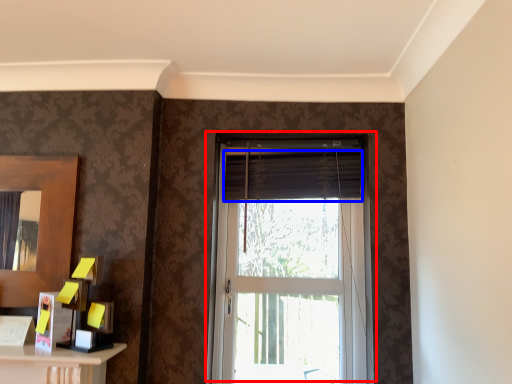
Question: Which object is closer to the camera taking this photo, window (highlighted by a red box) or curtain (highlighted by a blue box)?

Choices:
 (A) window
 (B) curtain

Answer: (A)